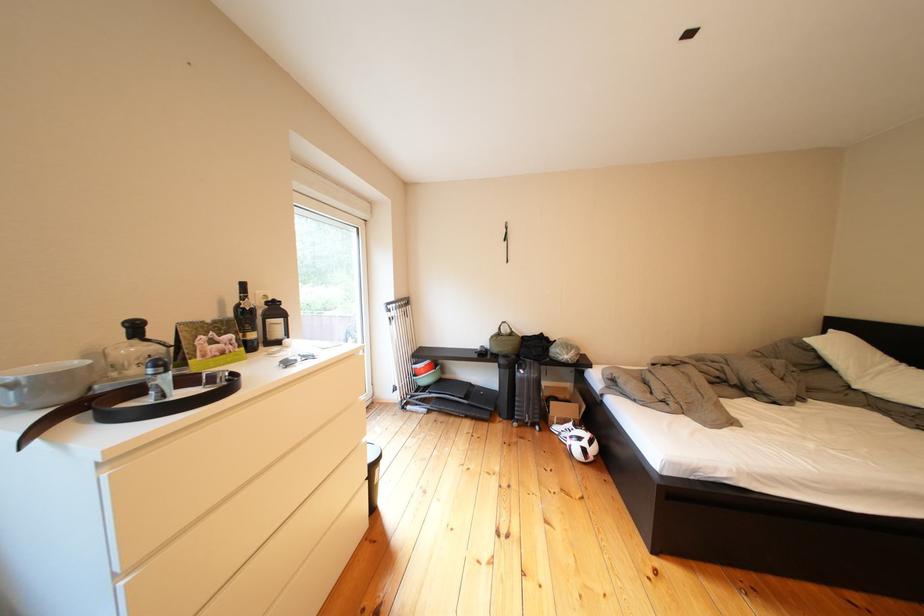
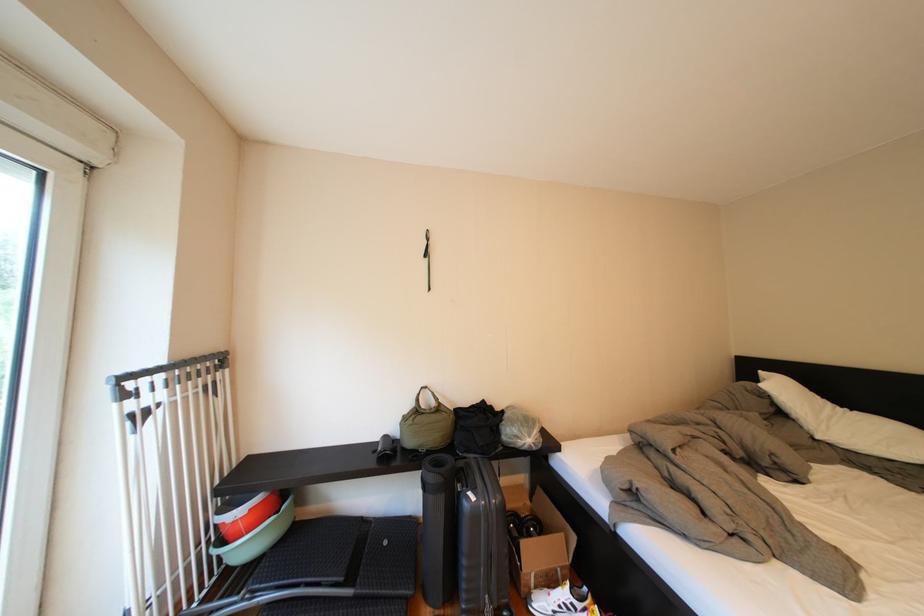
In the second image, find the point that corresponds to point (840, 371) in the first image.

(795, 419)